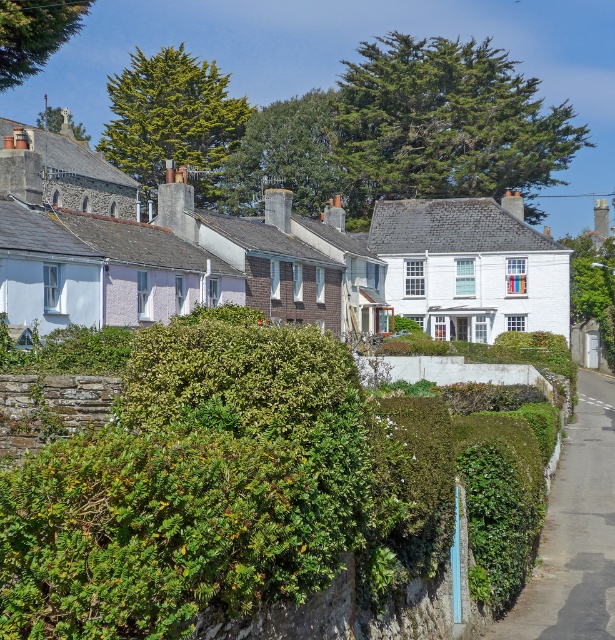
Between green leafy hedge at center and green leafy hedge at lower right, which one is positioned higher?

green leafy hedge at center is above.

Does green leafy hedge at center appear under green leafy hedge at lower right?

No.

Measure the distance between point (x=258, y=557) and camera.

Point (x=258, y=557) is 17.75 feet away from camera.

Identify the location of green leafy hedge at center. (255, 486).